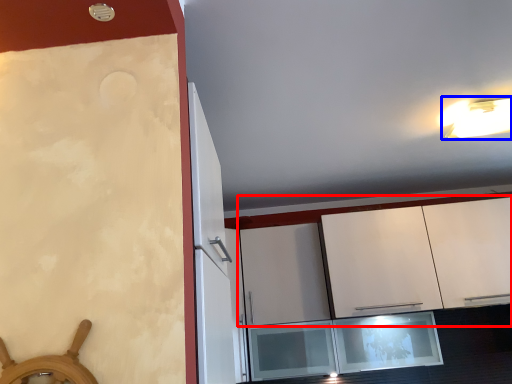
Question: Which of the following is the closest to the observer, cabinetry (highlighted by a red box) or light fixture (highlighted by a blue box)?

Choices:
 (A) cabinetry
 (B) light fixture

Answer: (B)